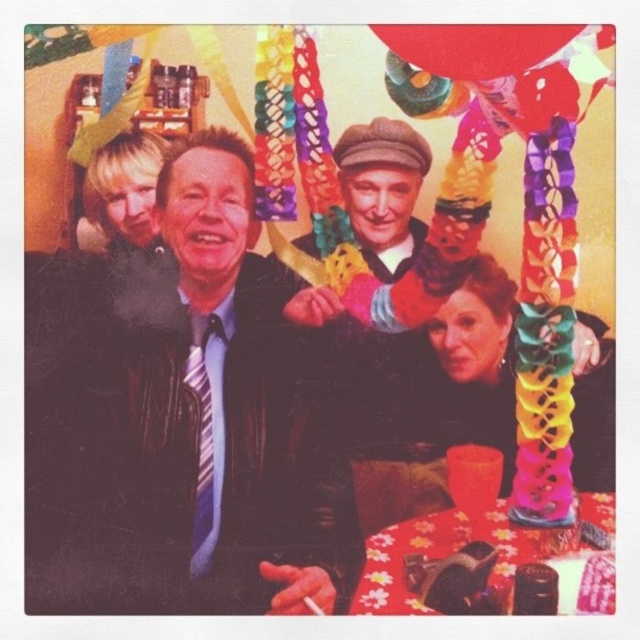
From the picture: Is leather jacket at center behind rubber balloon at upper center?

Yes, it is.

Who is higher up, leather jacket at center or rubber balloon at upper center?

rubber balloon at upper center is above.

This screenshot has width=640, height=640. In order to click on leather jacket at center in this screenshot , I will do `click(216, 412)`.